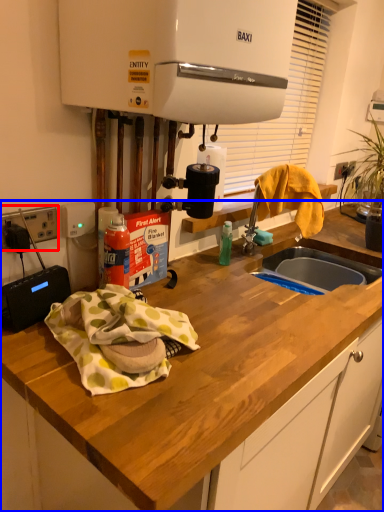
Question: Among these objects, which one is farthest to the camera, electric outlet (highlighted by a red box) or countertop (highlighted by a blue box)?

Choices:
 (A) electric outlet
 (B) countertop

Answer: (A)